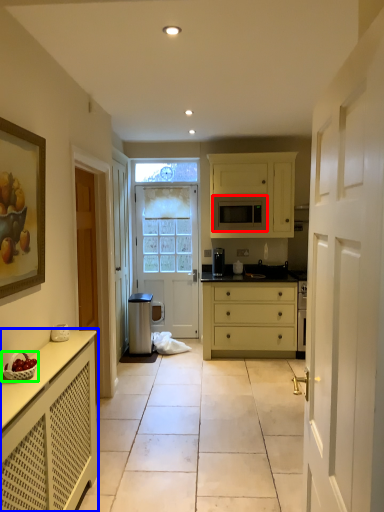
Question: Estimate the real-world distances between objects in this image. Which object is farther from microwave oven (highlighted by a red box), cabinetry (highlighted by a blue box) or fruit dish (highlighted by a green box)?

Choices:
 (A) cabinetry
 (B) fruit dish

Answer: (B)